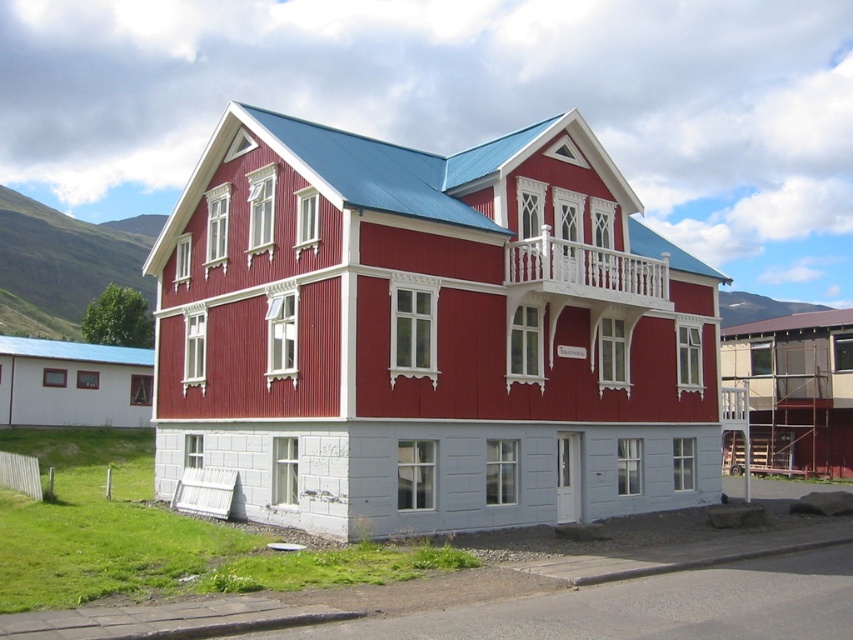
Is white wooden balcony at center above white wooden balcony at upper center?

No.

Describe the element at coordinates (428, 333) in the screenshot. I see `white wooden balcony at center` at that location.

At what (x,y) coordinates should I click in order to perform the action: click on white wooden balcony at center. Please return your answer as a coordinate pair (x, y). Looking at the image, I should click on (428, 333).